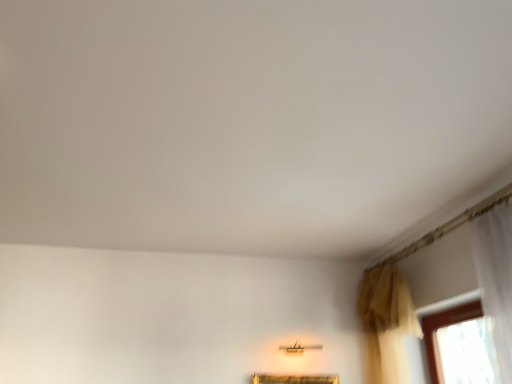
Question: Should I look upward or downward to see matte gold lamp at lower center?

Choices:
 (A) down
 (B) up

Answer: (A)